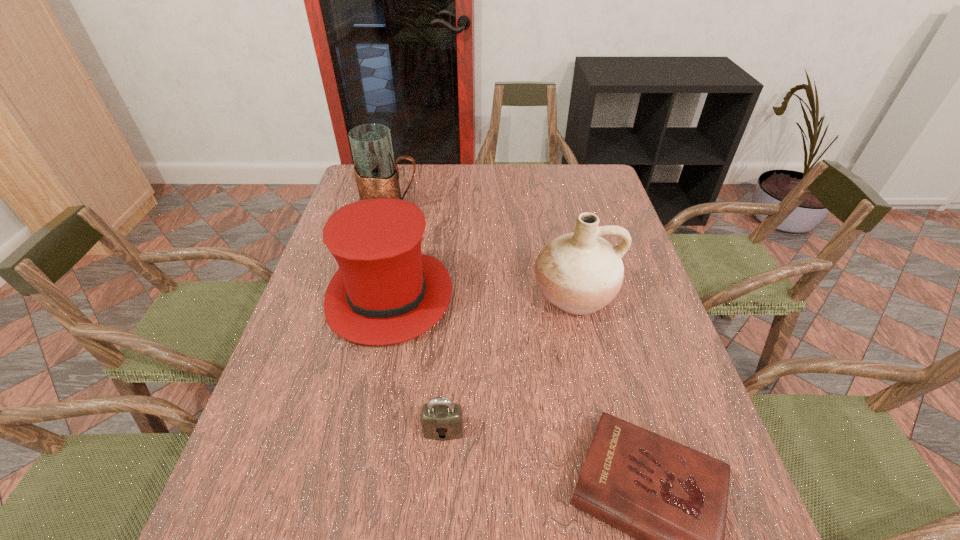
The width and height of the screenshot is (960, 540). I want to click on vacant space in between the pottery and the hat, so click(482, 296).

The width and height of the screenshot is (960, 540). Find the location of `vacant region between the pottery and the fourth tallest object`. vacant region between the pottery and the fourth tallest object is located at coordinates (509, 362).

Identify which object is the third nearest to the pitcher. Please provide its 2D coordinates. Your answer should be formatted as a tuple, i.e. [(x, y)], where the tuple contains the x and y coordinates of a point satisfying the conditions above.

[(441, 419)]

Locate an element on the screen. The image size is (960, 540). object that is the third nearest to the farthest object is located at coordinates (441, 419).